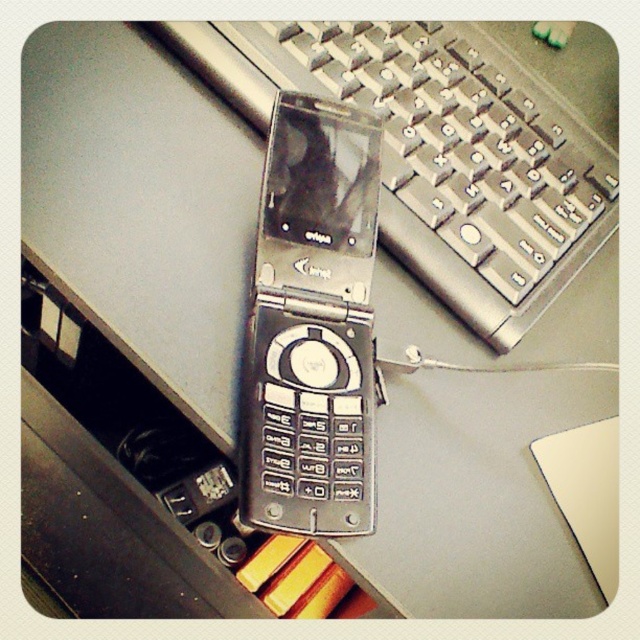
In the scene shown: You are organizing your desk and want to place the silver metallic keyboard at upper center and the silver metallic flip phone at center. If you have a small space, which item should you move to free up more space?

You should move the silver metallic keyboard at upper center because it is bigger than the silver metallic flip phone at center, freeing up more space.

You are organizing items on a desk and need to place a new item between the silver metallic keyboard at upper center and the silver metallic flip phone at center. Based on their positions, which side of the flip phone should you place the new item?

The silver metallic keyboard at upper center is positioned on the right side of the silver metallic flip phone at center, so you should place the new item to the left side of the silver metallic flip phone at center.

You are organizing a desk and need to place the silver metallic keyboard at upper center and the silver metallic flip phone at center. Given their sizes, which object should you place first to ensure there is enough space for both?

The silver metallic keyboard at upper center is much taller than the silver metallic flip phone at center. Therefore, you should place the silver metallic keyboard at upper center first to ensure there is enough space for both objects.